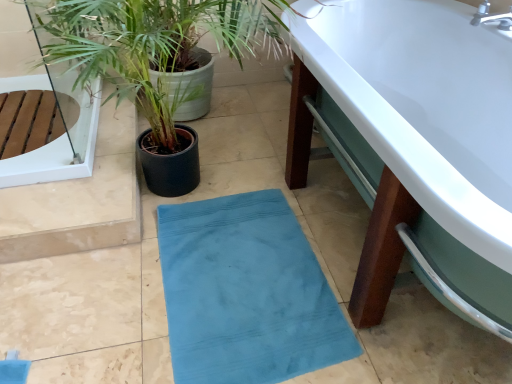
Locate an element on the screen. The image size is (512, 384). transparent glass door at upper left is located at coordinates (57, 153).

At what (x,y) coordinates should I click in order to perform the action: click on transparent glass door at upper left. Please return your answer as a coordinate pair (x, y). The width and height of the screenshot is (512, 384). Looking at the image, I should click on (57, 153).

Is white glossy bathtub at lower right situated inside transparent glass door at upper left or outside?

white glossy bathtub at lower right is not enclosed by transparent glass door at upper left.

Based on their positions, is white glossy bathtub at lower right located to the left or right of transparent glass door at upper left?

Clearly, white glossy bathtub at lower right is on the right of transparent glass door at upper left in the image.

Is white glossy bathtub at lower right facing away from transparent glass door at upper left?

No, transparent glass door at upper left is not at the back of white glossy bathtub at lower right.

Is point (73, 176) positioned before point (18, 48)?

Yes.

Between transparent glass door at upper left and green leafy plant at left, which one has smaller width?

Thinner between the two is green leafy plant at left.

Considering the relative sizes of transparent glass door at upper left and green leafy plant at left in the image provided, is transparent glass door at upper left taller than green leafy plant at left?

In fact, transparent glass door at upper left may be shorter than green leafy plant at left.

Is green leafy plant at left inside the boundaries of white glossy bathtub at lower right, or outside?

green leafy plant at left is located beyond the bounds of white glossy bathtub at lower right.

Considering the sizes of objects green leafy plant at left and white glossy bathtub at lower right in the image provided, who is taller, green leafy plant at left or white glossy bathtub at lower right?

Standing taller between the two is green leafy plant at left.

Is green leafy plant at left smaller than white glossy bathtub at lower right?

Correct, green leafy plant at left occupies less space than white glossy bathtub at lower right.

Is point (271, 74) positioned after point (442, 276)?

Yes, point (271, 74) is behind point (442, 276).

From a real-world perspective, is transparent glass door at upper left located beneath teal fabric bath mat at center?

Actually, transparent glass door at upper left is physically above teal fabric bath mat at center in the real world.

Which is in front, transparent glass door at upper left or teal fabric bath mat at center?

teal fabric bath mat at center is in front.

Is transparent glass door at upper left facing towards teal fabric bath mat at center?

No, transparent glass door at upper left is not oriented towards teal fabric bath mat at center.

In the scene shown: From the image's perspective, who appears lower, transparent glass door at upper left or teal fabric bath mat at center?

Result: teal fabric bath mat at center appears lower in the image.

From the image's perspective, would you say green leafy plant at left is positioned over teal fabric bath mat at center?

Correct, green leafy plant at left appears higher than teal fabric bath mat at center in the image.

In the image, there is a green leafy plant at left. Identify the location of bath mat below it (from the image's perspective). This screenshot has width=512, height=384. (246, 293).

Considering the relative sizes of green leafy plant at left and teal fabric bath mat at center in the image provided, is green leafy plant at left thinner than teal fabric bath mat at center?

In fact, green leafy plant at left might be wider than teal fabric bath mat at center.

Considering the sizes of objects green leafy plant at left and teal fabric bath mat at center in the image provided, who is shorter, green leafy plant at left or teal fabric bath mat at center?

With less height is teal fabric bath mat at center.

Consider the image. Which is more to the right, teal fabric bath mat at center or transparent glass door at upper left?

teal fabric bath mat at center.

The image size is (512, 384). In order to click on glass door above the teal fabric bath mat at center (from the image's perspective) in this screenshot , I will do `click(57, 153)`.

Could you tell me if teal fabric bath mat at center is turned towards transparent glass door at upper left?

No.

Considering their positions, is white glossy bathtub at lower right located in front of or behind green leafy plant at left?

white glossy bathtub at lower right is positioned closer to the viewer than green leafy plant at left.

Based on the photo, from the image's perspective, between white glossy bathtub at lower right and green leafy plant at left, who is located below?

white glossy bathtub at lower right appears lower in the image.

Who is bigger, white glossy bathtub at lower right or green leafy plant at left?

With larger size is white glossy bathtub at lower right.

Considering the sizes of objects white glossy bathtub at lower right and green leafy plant at left in the image provided, who is wider, white glossy bathtub at lower right or green leafy plant at left?

white glossy bathtub at lower right.

The width and height of the screenshot is (512, 384). In order to click on glass door on the left of white glossy bathtub at lower right in this screenshot , I will do `click(57, 153)`.

Where is `glass door located underneath the green leafy plant at left (from a real-world perspective)`? The width and height of the screenshot is (512, 384). glass door located underneath the green leafy plant at left (from a real-world perspective) is located at coordinates (57, 153).

From the image, which object appears to be nearer to teal fabric bath mat at center, white glossy bathtub at lower right or transparent glass door at upper left?

transparent glass door at upper left.

Which object lies further to the anchor point green leafy plant at left, transparent glass door at upper left or teal fabric bath mat at center?

Based on the image, teal fabric bath mat at center appears to be further to green leafy plant at left.

Based on the photo, when comparing their distances from green leafy plant at left, does teal fabric bath mat at center or white glossy bathtub at lower right seem further?

white glossy bathtub at lower right is further to green leafy plant at left.

Looking at the image, which one is located further to white glossy bathtub at lower right, green leafy plant at left or teal fabric bath mat at center?

green leafy plant at left.

Looking at the image, which one is located further to green leafy plant at left, teal fabric bath mat at center or transparent glass door at upper left?

teal fabric bath mat at center is positioned further to the anchor green leafy plant at left.

Which object lies nearer to the anchor point teal fabric bath mat at center, transparent glass door at upper left or green leafy plant at left?

Among the two, transparent glass door at upper left is located nearer to teal fabric bath mat at center.

When comparing their distances from transparent glass door at upper left, does green leafy plant at left or teal fabric bath mat at center seem closer?

Based on the image, green leafy plant at left appears to be nearer to transparent glass door at upper left.

From the image, which object appears to be nearer to green leafy plant at left, white glossy bathtub at lower right or teal fabric bath mat at center?

teal fabric bath mat at center is closer to green leafy plant at left.

Locate an element on the screen. bath mat between green leafy plant at left and white glossy bathtub at lower right is located at coordinates click(246, 293).

In order to click on bath mat situated between transparent glass door at upper left and white glossy bathtub at lower right from left to right in this screenshot , I will do `click(246, 293)`.

Find the location of a particular element. The width and height of the screenshot is (512, 384). houseplant located between transparent glass door at upper left and teal fabric bath mat at center in the left-right direction is located at coordinates (36, 169).

Identify the location of houseplant situated between transparent glass door at upper left and white glossy bathtub at lower right from left to right. click(x=36, y=169).